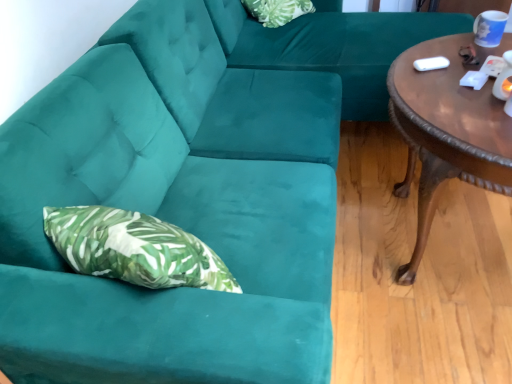
Question: Is velvet green couch at center bigger or smaller than brown polished wood coffee table at right?

Choices:
 (A) small
 (B) big

Answer: (B)

Question: Considering the positions of velvet green couch at center and brown polished wood coffee table at right in the image, is velvet green couch at center wider or thinner than brown polished wood coffee table at right?

Choices:
 (A) thin
 (B) wide

Answer: (B)

Question: Based on their relative distances, which object is farther from the brown polished wood coffee table at right?

Choices:
 (A) velvet green couch at center
 (B) green leafy fabric pillow at upper center

Answer: (B)

Question: Estimate the real-world distances between objects in this image. Which object is closer to the velvet green couch at center?

Choices:
 (A) brown polished wood coffee table at right
 (B) green leafy fabric pillow at upper center

Answer: (B)